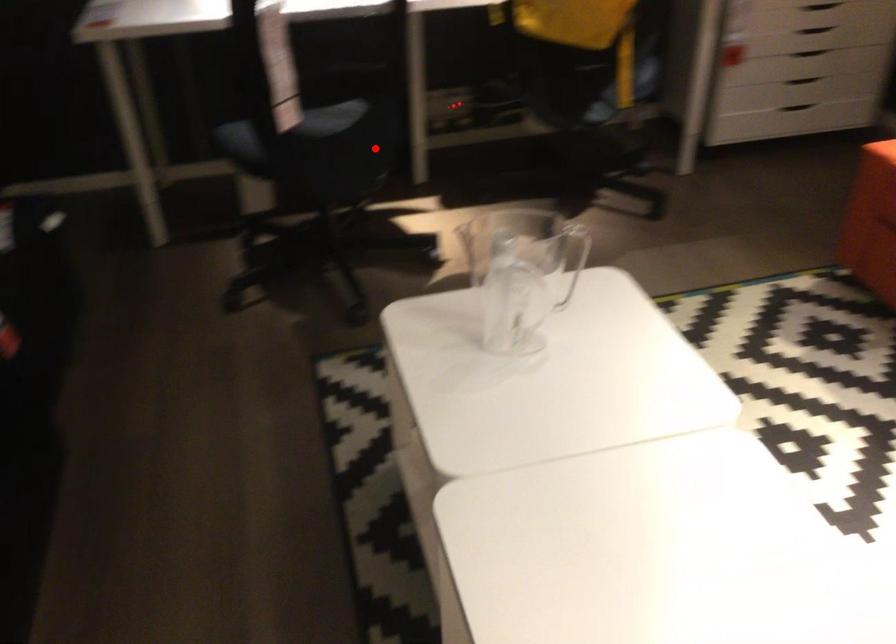
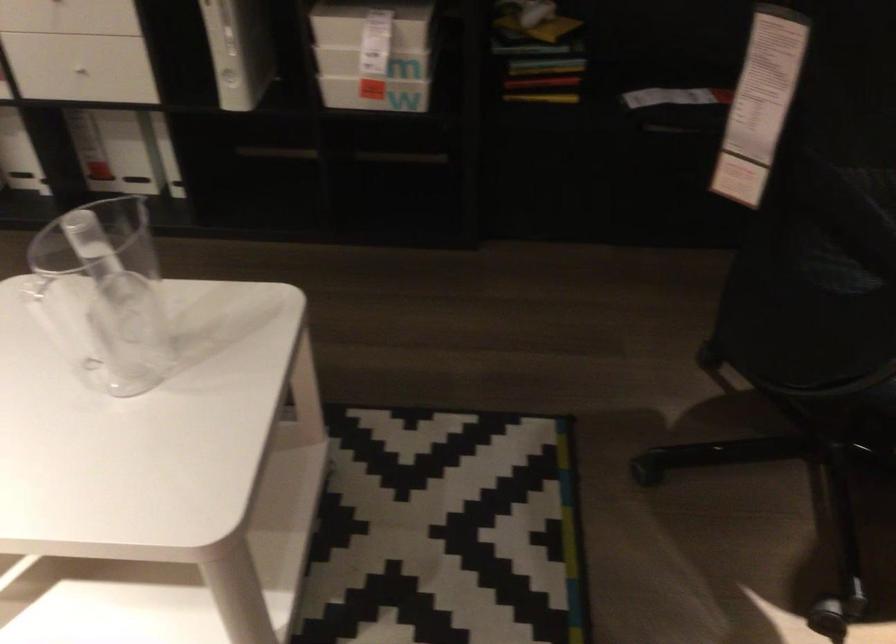
Question: I am providing you with two images of the same scene from different viewpoints. A red point is marked on the first image. Can you still see the location of the red point in image 2?

Choices:
 (A) Yes
 (B) No

Answer: (A)